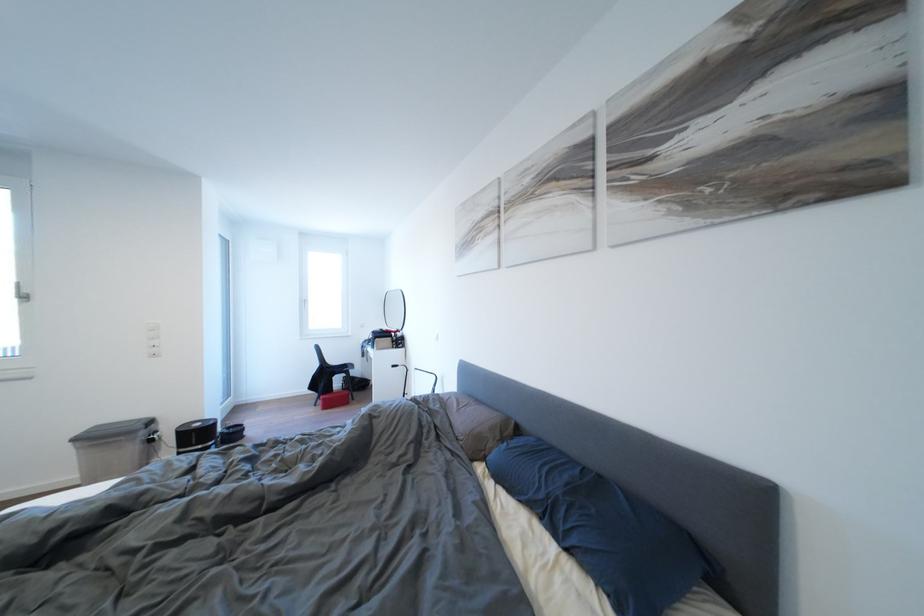
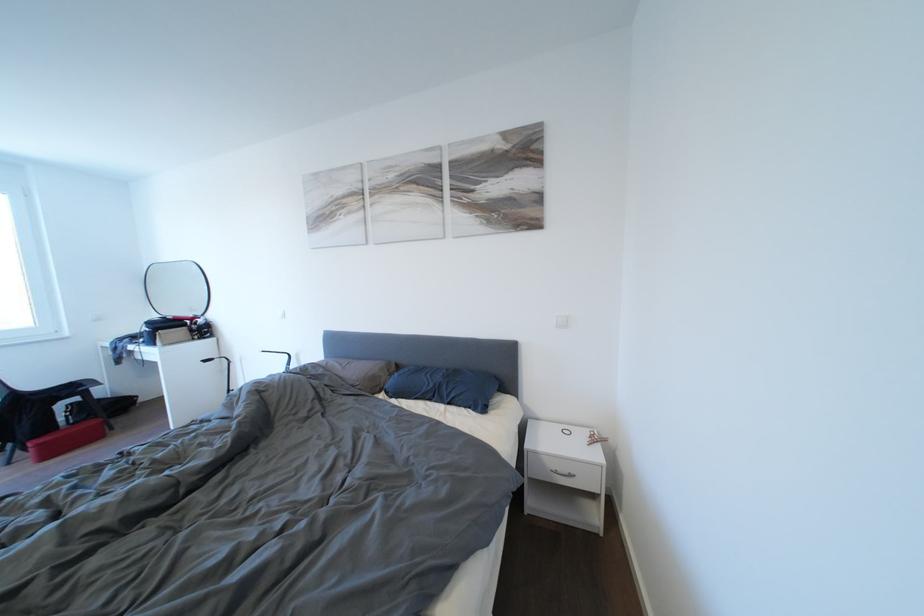
Where in the second image is the point corresponding to [332,405] from the first image?

(46, 450)